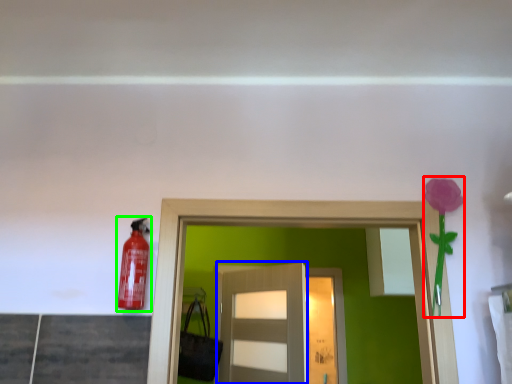
Question: Which is farther away from flower (highlighted by a red box)? door (highlighted by a blue box) or extinguisher (highlighted by a green box)?

Choices:
 (A) door
 (B) extinguisher

Answer: (A)